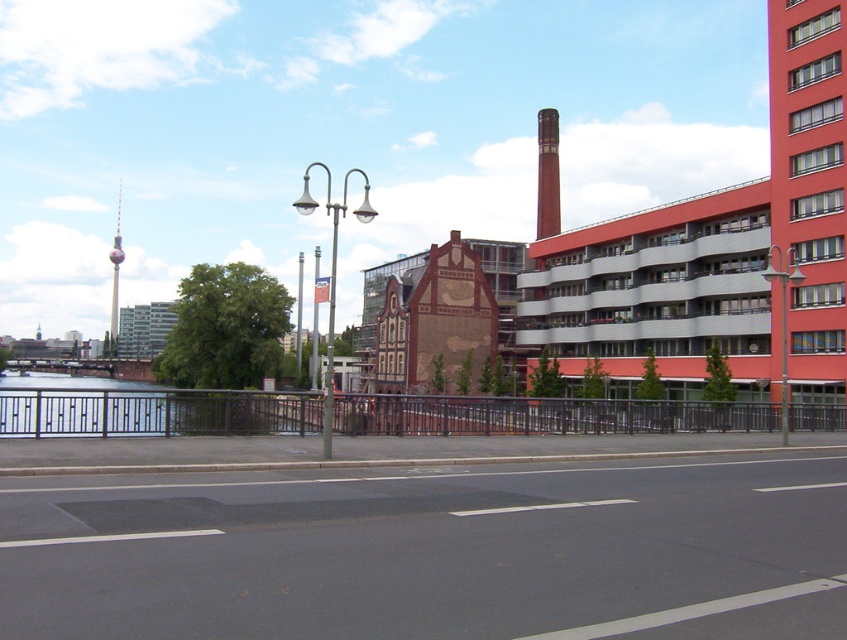
You are a pedestrian standing on the paved road and want to take a photo of the red brick chimney at center without any obstructions. Is the metallic water at left blocking your view of the chimney?

The metallic water at left is in front of the red brick chimney at center, so it is blocking the view of the chimney.

You are standing at the edge of the road looking towards the water. There are two points marked in the scene, point A at coordinates point (x=62, y=388) and point B at coordinates point (x=549, y=192). Which point is closer to you?

Point A at coordinates point (x=62, y=388) is closer to you than point B at coordinates point (x=549, y=192).